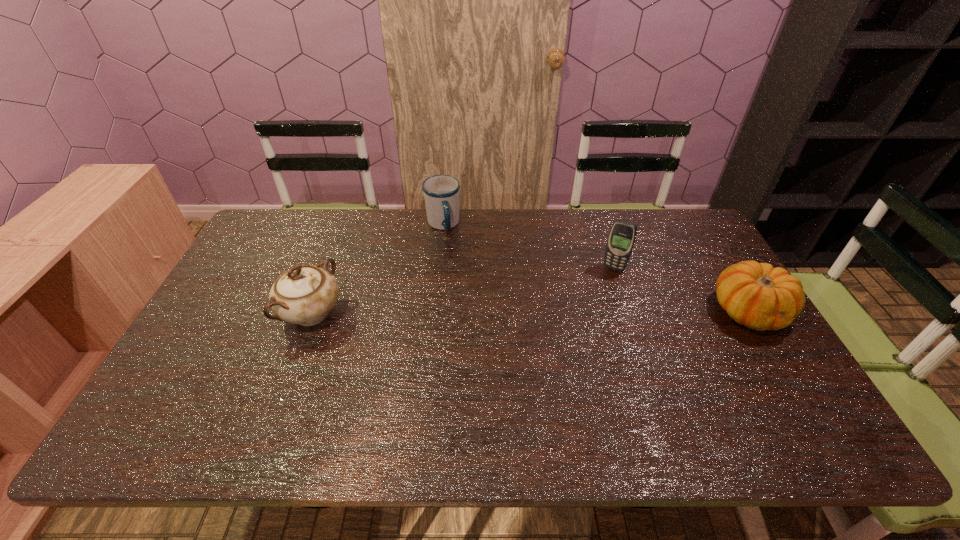
This screenshot has height=540, width=960. What are the coordinates of `the leftmost object` in the screenshot? It's located at (305, 295).

You are a GUI agent. You are given a task and a screenshot of the screen. Output one action in this format:
    pyautogui.click(x=<x>, y=<y>)
    Task: Click on the gourd
    The width and height of the screenshot is (960, 540).
    Given the screenshot: What is the action you would take?
    pyautogui.click(x=757, y=295)

Image resolution: width=960 pixels, height=540 pixels. What are the coordinates of `the farthest object` in the screenshot? It's located at coord(441,192).

The width and height of the screenshot is (960, 540). I want to click on the third object from right to left, so click(x=441, y=192).

Identify the location of cellular telephone. (622, 236).

Locate an element on the screen. Image resolution: width=960 pixels, height=540 pixels. the second object from right to left is located at coordinates (622, 236).

This screenshot has height=540, width=960. Identify the location of free region located 0.150m on the front of the leftmost object. (283, 390).

Where is `free point located 0.200m on the left of the gourd`? free point located 0.200m on the left of the gourd is located at coordinates (641, 312).

Locate an element on the screen. vacant space located 0.260m on the handle side of the mug is located at coordinates (468, 292).

At what (x,y) coordinates should I click in order to perform the action: click on free space located on the handle side of the mug. Please return your answer as a coordinate pair (x, y). The image size is (960, 540). Looking at the image, I should click on (458, 266).